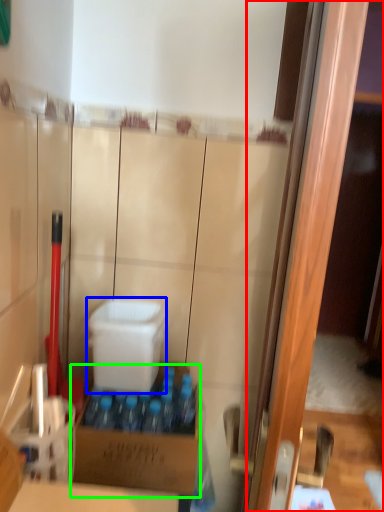
Question: Based on their relative distances, which object is farther from screen door (highlighted by a red box)? Choose from box (highlighted by a blue box) and box (highlighted by a green box).

Choices:
 (A) box
 (B) box

Answer: (A)